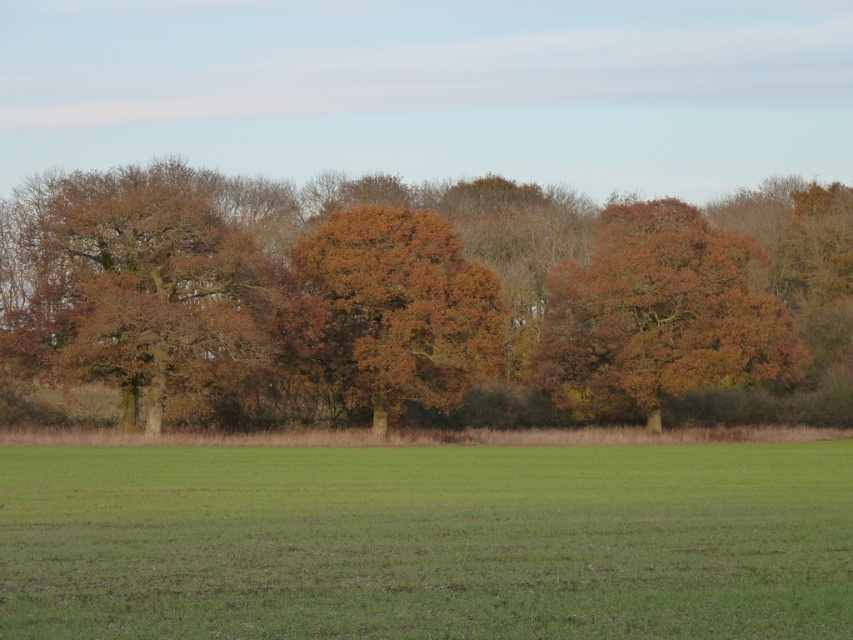
Does brown textured trees at center lie behind brown matte tree at center-right?

No.

Who is more forward, (503, 204) or (666, 388)?

Point (666, 388)

Image resolution: width=853 pixels, height=640 pixels. What do you see at coordinates (427, 300) in the screenshot?
I see `brown textured trees at center` at bounding box center [427, 300].

Locate an element on the screen. This screenshot has width=853, height=640. brown textured trees at center is located at coordinates (427, 300).

Find the location of a particular element. green grass at center is located at coordinates (426, 541).

Who is higher up, green grass at center or brown matte tree at center-right?

brown matte tree at center-right is higher up.

Between point (416, 616) and point (627, 230), which one is positioned behind?

Positioned behind is point (627, 230).

Locate an element on the screen. green grass at center is located at coordinates (426, 541).

Who is lower down, brown matte tree at left or brown matte tree at center-right?

brown matte tree at center-right is lower down.

Does brown matte tree at left appear on the right side of brown matte tree at center-right?

In fact, brown matte tree at left is to the left of brown matte tree at center-right.

The height and width of the screenshot is (640, 853). Describe the element at coordinates (137, 289) in the screenshot. I see `brown matte tree at left` at that location.

You are a GUI agent. You are given a task and a screenshot of the screen. Output one action in this format:
    pyautogui.click(x=<x>, y=<y>)
    Task: Click on the brown matte tree at left
    
    Given the screenshot: What is the action you would take?
    pyautogui.click(x=137, y=289)